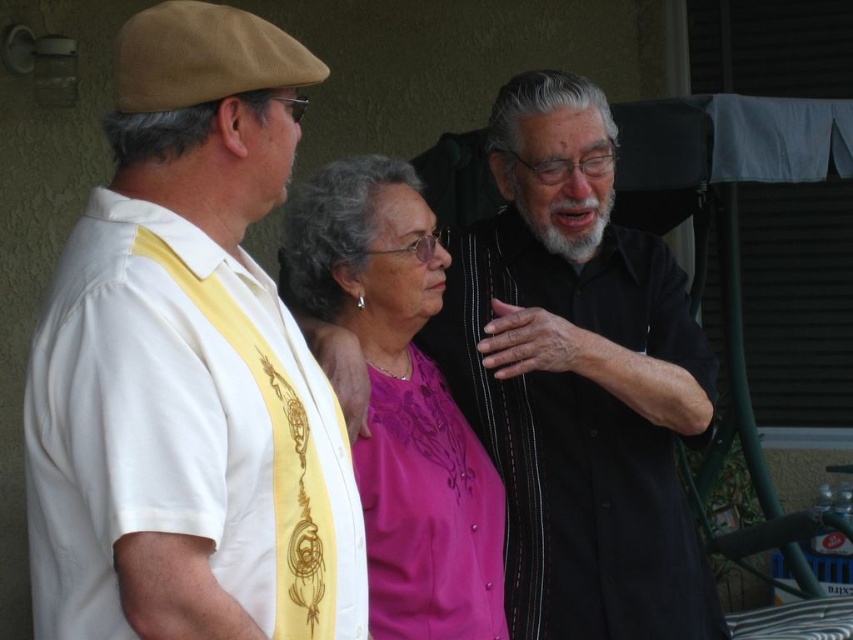
Question: Which object is closer to the camera taking this photo?

Choices:
 (A) white matte shirt at left
 (B) purple satin blouse at center

Answer: (A)

Question: Is white matte shirt at left positioned before purple satin blouse at center?

Choices:
 (A) no
 (B) yes

Answer: (B)

Question: Is black textured shirt at center in front of purple satin blouse at center?

Choices:
 (A) no
 (B) yes

Answer: (A)

Question: Which object is closer to the camera taking this photo?

Choices:
 (A) purple satin blouse at center
 (B) white matte shirt at left

Answer: (B)

Question: Based on their relative distances, which object is farther from the black textured shirt at center?

Choices:
 (A) purple satin blouse at center
 (B) white matte shirt at left

Answer: (B)

Question: From the image, what is the correct spatial relationship of black textured shirt at center in relation to purple satin blouse at center?

Choices:
 (A) above
 (B) below

Answer: (A)